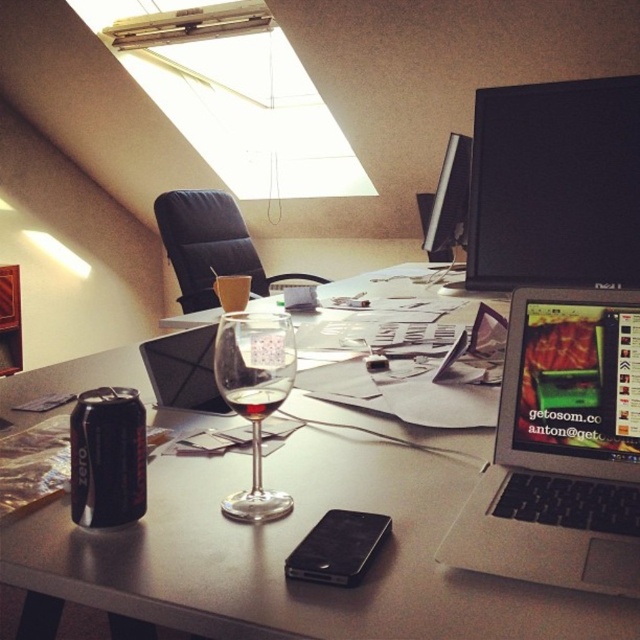
Question: Does silver metallic laptop at right appear on the right side of black matte can at center-left?

Choices:
 (A) yes
 (B) no

Answer: (A)

Question: Which point appears farthest from the camera in this image?

Choices:
 (A) (240, 413)
 (B) (552, 250)

Answer: (B)

Question: Is matte glass table at center smaller than clear glass wine glass at center?

Choices:
 (A) no
 (B) yes

Answer: (A)

Question: Is silver metallic laptop at right thinner than black matte can at center-left?

Choices:
 (A) yes
 (B) no

Answer: (B)

Question: Among these points, which one is nearest to the camera?

Choices:
 (A) (561, 204)
 (B) (109, 435)
 (C) (449, 220)
 (D) (92, 364)

Answer: (B)

Question: Which of these objects is positioned farthest from the black matte monitor at upper right?

Choices:
 (A) clear glass wine glass at center
 (B) silver metallic laptop at right

Answer: (A)